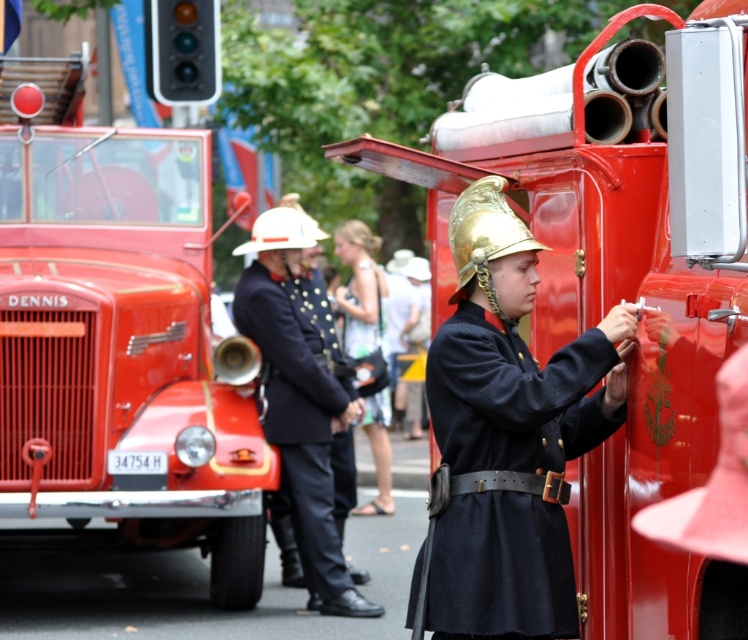
You are a photographer trying to capture the shiny red fire truck at center and the navy blue fabric uniform at center in a single shot. Since both are at center, how can you adjust your camera angle to ensure both are visible in the frame?

The shiny red fire truck at center is in front of the navy blue fabric uniform at center, so you should move your camera angle slightly backward to create more depth and ensure both objects are visible in the frame.